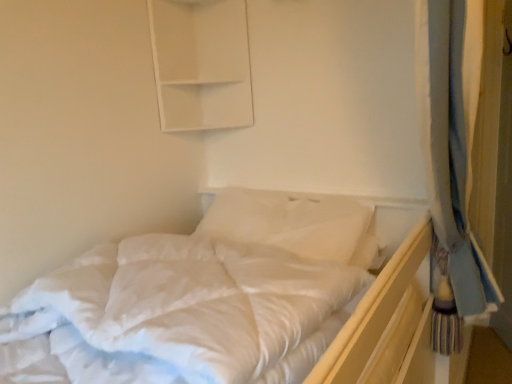
Question: From a real-world perspective, is white soft bed at center on top of white soft pillow at center?

Choices:
 (A) no
 (B) yes

Answer: (A)

Question: Does white soft bed at center appear on the left side of white soft pillow at center?

Choices:
 (A) no
 (B) yes

Answer: (B)

Question: Is white soft bed at center further to camera compared to white soft pillow at center?

Choices:
 (A) yes
 (B) no

Answer: (B)

Question: From the image's perspective, would you say white soft bed at center is positioned over white soft pillow at center?

Choices:
 (A) yes
 (B) no

Answer: (B)

Question: Is white soft bed at center facing towards white soft pillow at center?

Choices:
 (A) yes
 (B) no

Answer: (B)

Question: In the image, is white soft bed at center on the left side or the right side of white matte cabinet at upper center?

Choices:
 (A) right
 (B) left

Answer: (B)

Question: Considering the positions of white soft bed at center and white matte cabinet at upper center in the image, is white soft bed at center wider or thinner than white matte cabinet at upper center?

Choices:
 (A) wide
 (B) thin

Answer: (A)

Question: Does point (230, 228) appear closer or farther from the camera than point (163, 26)?

Choices:
 (A) closer
 (B) farther

Answer: (A)

Question: Considering the positions of white soft bed at center and white matte cabinet at upper center in the image, is white soft bed at center bigger or smaller than white matte cabinet at upper center?

Choices:
 (A) small
 (B) big

Answer: (B)

Question: Looking at the image, does white soft bed at center seem bigger or smaller compared to white soft pillow at center?

Choices:
 (A) big
 (B) small

Answer: (A)

Question: From the image's perspective, is white soft bed at center located above or below white soft pillow at center?

Choices:
 (A) below
 (B) above

Answer: (A)

Question: Is white soft bed at center inside the boundaries of white soft pillow at center, or outside?

Choices:
 (A) outside
 (B) inside

Answer: (A)

Question: Considering the positions of point (186, 352) and point (304, 236), is point (186, 352) closer or farther from the camera than point (304, 236)?

Choices:
 (A) closer
 (B) farther

Answer: (A)

Question: Is white soft pillow at center in front of or behind white soft bed at center in the image?

Choices:
 (A) behind
 (B) front

Answer: (A)

Question: Considering the positions of white soft pillow at center and white soft bed at center in the image, is white soft pillow at center taller or shorter than white soft bed at center?

Choices:
 (A) short
 (B) tall

Answer: (B)